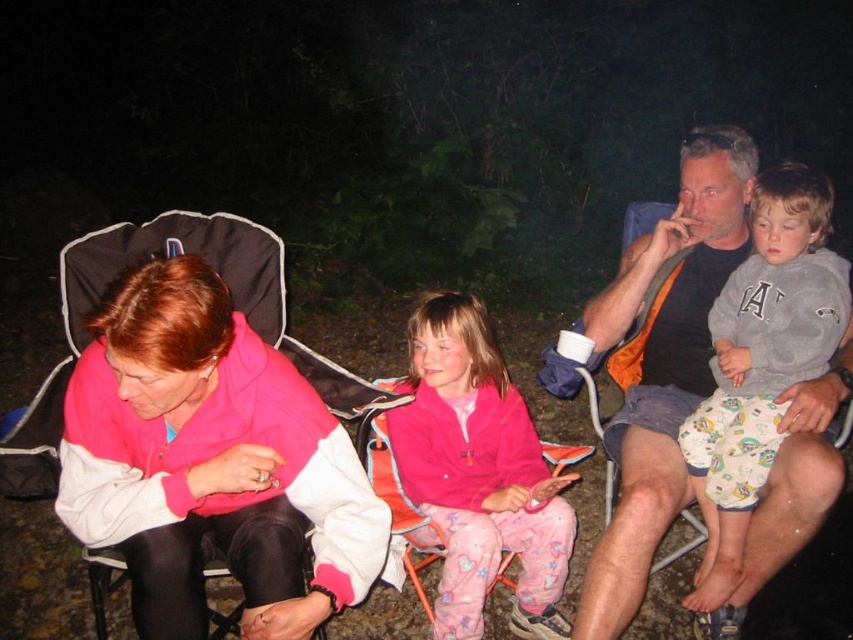
In the nighttime scene, there are two people wearing the pink fleece jacket at left and the gray cotton sweatshirt at upper right. Which one is positioned more to the left side?

The pink fleece jacket at left is positioned more to the left side than the gray cotton sweatshirt at upper right.

Consider the image. You are a photographer standing at the center of the semi circle of chairs. You want to take a photo of the pink fleece jacket at left and the blue flannel shirt at right. How far apart are the two subjects?

The two subjects, the pink fleece jacket at left and the blue flannel shirt at right, are 1.32 meters apart.